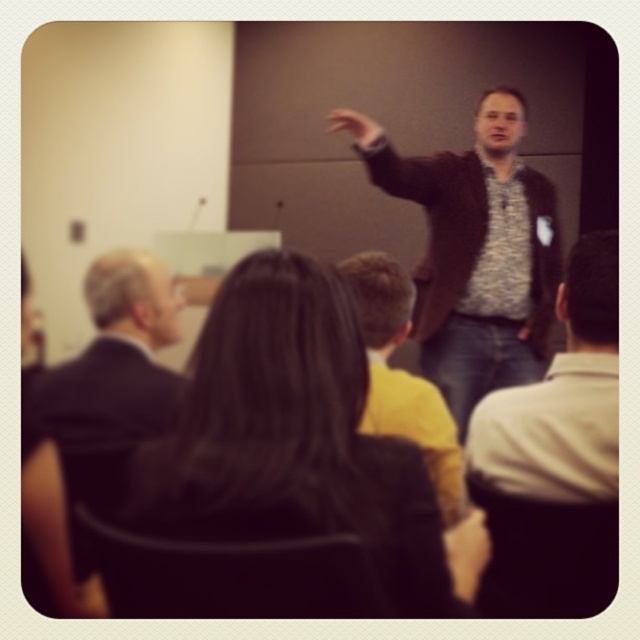
What are the coordinates of `black suit at left` in the screenshot? It's located at (113, 376).

Between point (42, 419) and point (371, 339), which one is positioned in front?

Positioned in front is point (42, 419).

Image resolution: width=640 pixels, height=640 pixels. What do you see at coordinates (113, 376) in the screenshot?
I see `black suit at left` at bounding box center [113, 376].

Identify the location of black suit at left. This screenshot has width=640, height=640. (113, 376).

Where is `patterned fabric shirt at center`? This screenshot has height=640, width=640. patterned fabric shirt at center is located at coordinates (561, 397).

Image resolution: width=640 pixels, height=640 pixels. Identify the location of patterned fabric shirt at center. (561, 397).

Find the location of a particular element. patterned fabric shirt at center is located at coordinates (561, 397).

Is dark brown leather jacket at center in front of patterned fabric shirt at center?

No, it is not.

Does dark brown leather jacket at center appear over patterned fabric shirt at center?

Yes.

Between point (506, 188) and point (586, 268), which one is positioned in front?

Positioned in front is point (586, 268).

Locate an element on the screen. This screenshot has height=640, width=640. dark brown leather jacket at center is located at coordinates (474, 252).